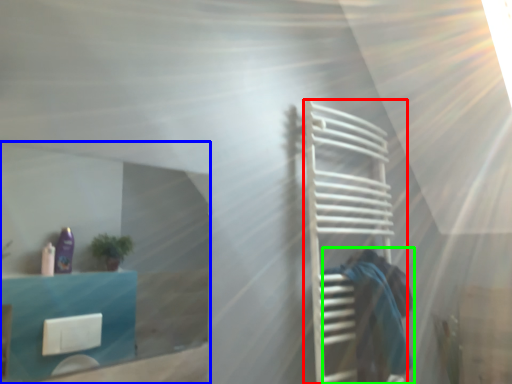
Question: Based on their relative distances, which object is nearer to cage (highlighted by a red box)? Choose from glass door (highlighted by a blue box) and person (highlighted by a green box).

Choices:
 (A) glass door
 (B) person

Answer: (B)